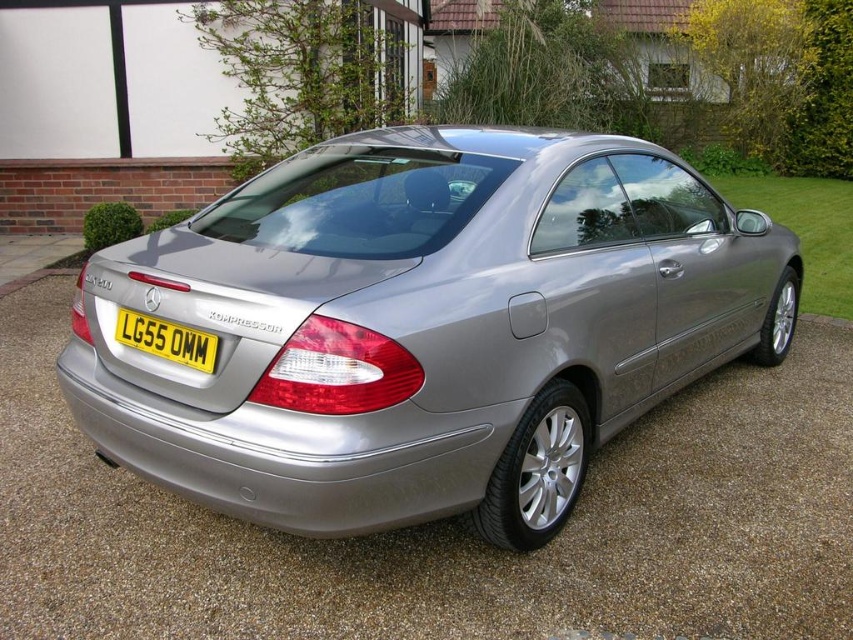
Question: Which point is farther to the camera?

Choices:
 (A) yellow metallic license plate at rear
 (B) satin silver car at center

Answer: (A)

Question: Is satin silver car at center positioned at the back of yellow metallic license plate at rear?

Choices:
 (A) yes
 (B) no

Answer: (B)

Question: Can you confirm if satin silver car at center is bigger than yellow metallic license plate at rear?

Choices:
 (A) no
 (B) yes

Answer: (B)

Question: Is satin silver car at center thinner than yellow metallic license plate at rear?

Choices:
 (A) no
 (B) yes

Answer: (A)